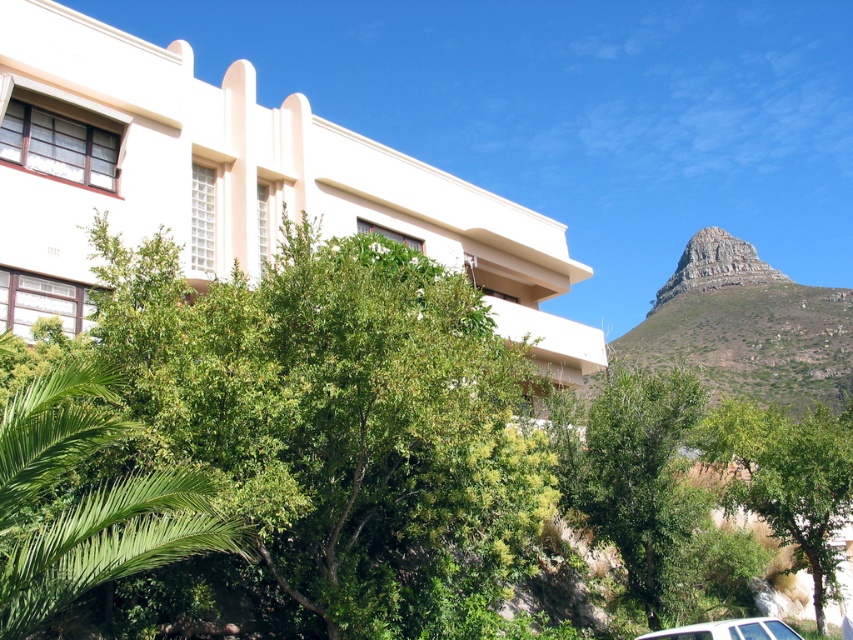
Question: In this image, where is green leafy tree at center located relative to green grassy mountain at upper right?

Choices:
 (A) below
 (B) above

Answer: (A)

Question: Among these objects, which one is nearest to the camera?

Choices:
 (A) white matte car at lower right
 (B) green leafy tree at center
 (C) green leafy tree at lower right

Answer: (B)

Question: Is green grassy mountain at upper right further to the viewer compared to green leafy tree at lower right?

Choices:
 (A) no
 (B) yes

Answer: (B)

Question: Which object is positioned farthest from the green grassy mountain at upper right?

Choices:
 (A) white matte car at lower right
 (B) green leafy tree at center
 (C) green leafy tree at lower right
 (D) green leafy palm at lower left

Answer: (D)

Question: Which object is closer to the camera taking this photo?

Choices:
 (A) green grassy mountain at upper right
 (B) white matte building at upper center

Answer: (B)

Question: Does green leafy tree at center appear under white matte car at lower right?

Choices:
 (A) yes
 (B) no

Answer: (B)